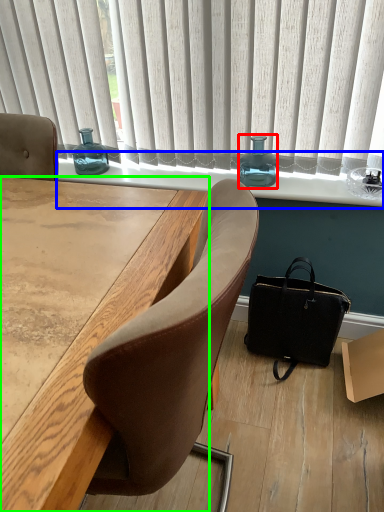
Question: Based on their relative distances, which object is farther from bottle (highlighted by a red box)? Choose from window sill (highlighted by a blue box) and desk (highlighted by a green box).

Choices:
 (A) window sill
 (B) desk

Answer: (B)